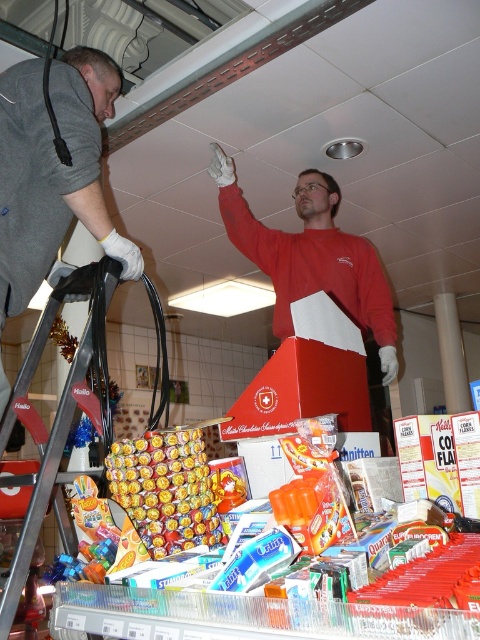
Question: Does gray fabric jacket at left appear on the right side of metallic silver ladder at left?

Choices:
 (A) yes
 (B) no

Answer: (B)

Question: Does shiny yellow candy at center come behind metallic silver ladder at left?

Choices:
 (A) no
 (B) yes

Answer: (B)

Question: Which object is positioned closest to the metallic silver ladder at left?

Choices:
 (A) matte red sweater at upper center
 (B) gray fabric jacket at left
 (C) shiny yellow candy at center

Answer: (C)

Question: Which object is positioned farthest from the matte red sweater at upper center?

Choices:
 (A) metallic silver ladder at left
 (B) shiny yellow candy at center

Answer: (B)

Question: Which object is farther from the camera taking this photo?

Choices:
 (A) matte red sweater at upper center
 (B) gray fabric jacket at left

Answer: (A)

Question: Is gray fabric jacket at left bigger than matte red sweater at upper center?

Choices:
 (A) yes
 (B) no

Answer: (B)